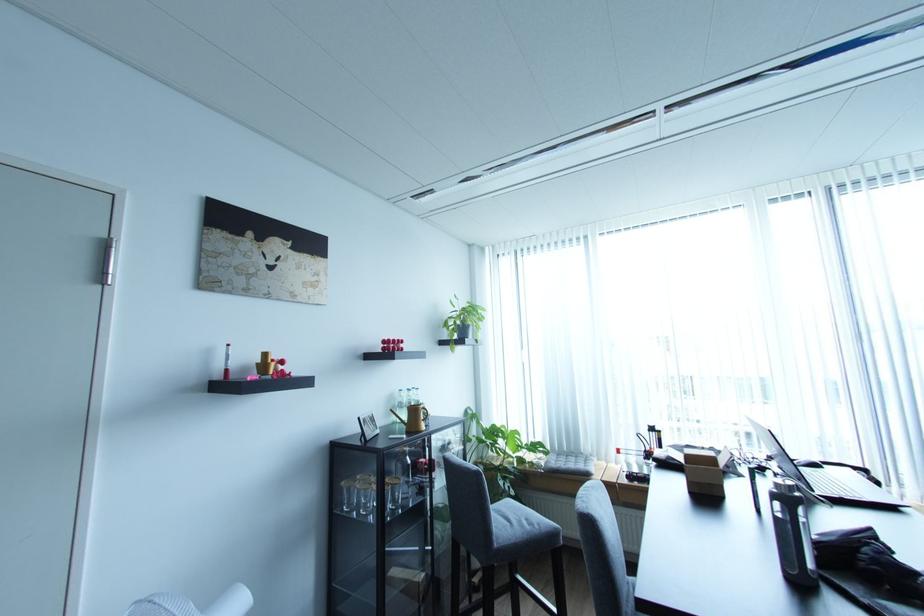
This screenshot has width=924, height=616. What are the coordinates of `grey water bottle` in the screenshot? It's located at (399, 411).